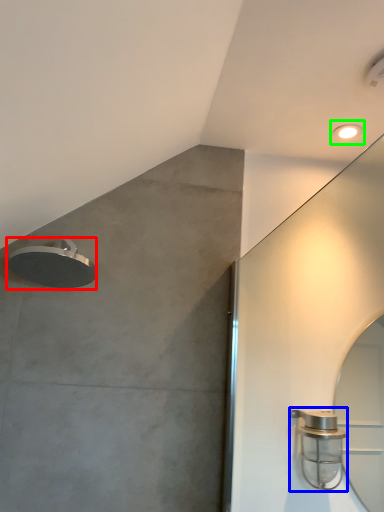
Question: Which object is the closest to the shower (highlighted by a red box)? Choose among these: shower (highlighted by a blue box) or droplight (highlighted by a green box).

Choices:
 (A) shower
 (B) droplight

Answer: (A)